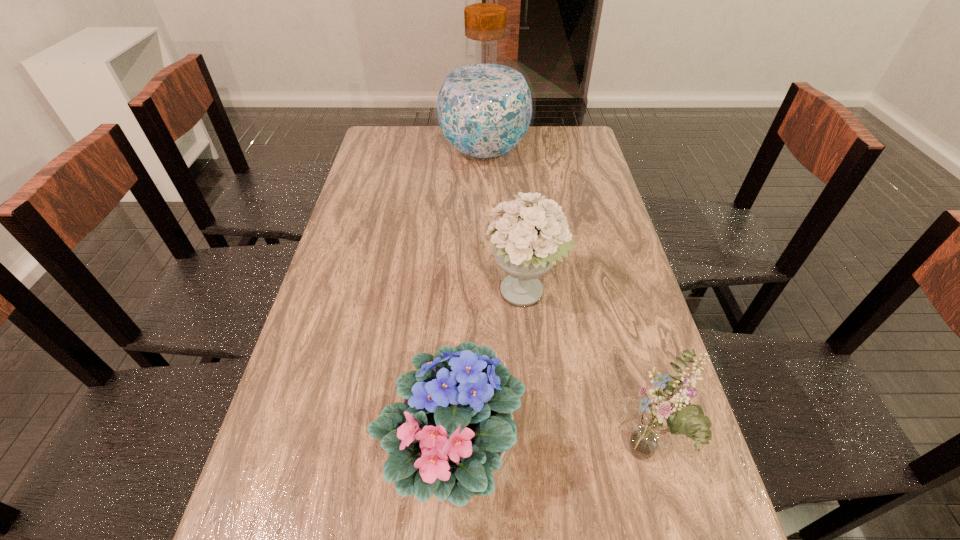
Where is `the farthest object`? This screenshot has height=540, width=960. the farthest object is located at coordinates (484, 106).

Identify the location of water jug. The width and height of the screenshot is (960, 540). (484, 106).

I want to click on the farthest bouquet, so click(x=528, y=239).

This screenshot has width=960, height=540. I want to click on the rightmost object, so click(x=650, y=431).

Find the location of `the shortest bouquet`. the shortest bouquet is located at coordinates (452, 434).

What are the coordinates of `vacant space located on the front of the tallest object` in the screenshot? It's located at (486, 217).

Find the location of a particular element. The height and width of the screenshot is (540, 960). free space located on the back of the farthest bouquet is located at coordinates (516, 190).

I want to click on vacant space situated on the front-facing side of the rightmost object, so click(531, 456).

The image size is (960, 540). What are the coordinates of `free space located 0.210m on the front-facing side of the rightmost object` in the screenshot? It's located at (506, 456).

Identify the location of free space located on the front-facing side of the rightmost object. (485, 456).